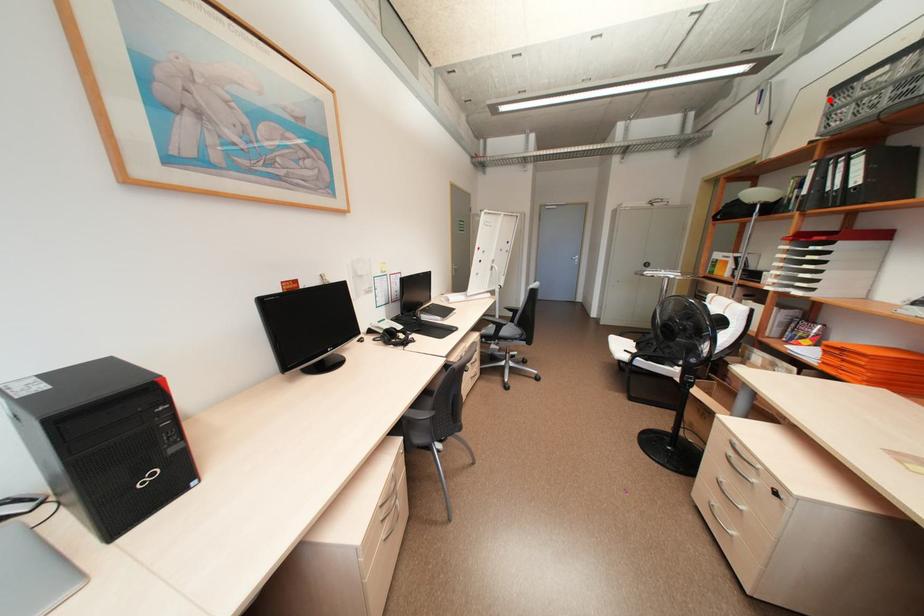
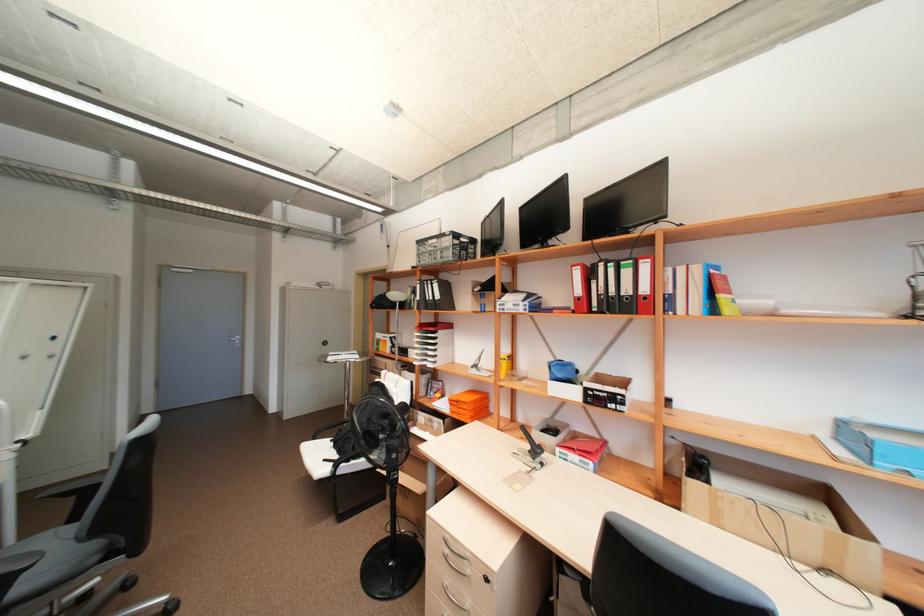
Question: I am providing you with two images of the same scene from different viewpoints. A red point is marked on the first image. Can you still see the location of the red point in image 2?

Choices:
 (A) Yes
 (B) No

Answer: (A)